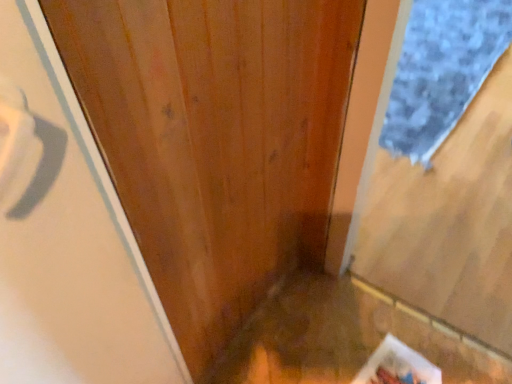
Question: Does white glossy screen door at left have a larger size compared to blue textured mat at right?

Choices:
 (A) no
 (B) yes

Answer: (A)

Question: Can you confirm if white glossy screen door at left is positioned to the left of blue textured mat at right?

Choices:
 (A) no
 (B) yes

Answer: (B)

Question: Does white glossy screen door at left come in front of blue textured mat at right?

Choices:
 (A) yes
 (B) no

Answer: (A)

Question: From a real-world perspective, is white glossy screen door at left over blue textured mat at right?

Choices:
 (A) yes
 (B) no

Answer: (A)

Question: Is white glossy screen door at left oriented away from blue textured mat at right?

Choices:
 (A) no
 (B) yes

Answer: (A)

Question: Can you see white glossy screen door at left touching blue textured mat at right?

Choices:
 (A) yes
 (B) no

Answer: (B)

Question: Is blue textured mat at right far from white glossy screen door at left?

Choices:
 (A) yes
 (B) no

Answer: (A)

Question: Does blue textured mat at right have a smaller size compared to white glossy screen door at left?

Choices:
 (A) no
 (B) yes

Answer: (A)

Question: Is blue textured mat at right oriented towards white glossy screen door at left?

Choices:
 (A) yes
 (B) no

Answer: (B)

Question: Does blue textured mat at right appear on the right side of white glossy screen door at left?

Choices:
 (A) no
 (B) yes

Answer: (B)

Question: From the image's perspective, is blue textured mat at right located above white glossy screen door at left?

Choices:
 (A) yes
 (B) no

Answer: (A)

Question: Can we say blue textured mat at right lies outside white glossy screen door at left?

Choices:
 (A) yes
 (B) no

Answer: (A)

Question: Considering the positions of point (167, 347) and point (417, 132), is point (167, 347) closer or farther from the camera than point (417, 132)?

Choices:
 (A) closer
 (B) farther

Answer: (A)